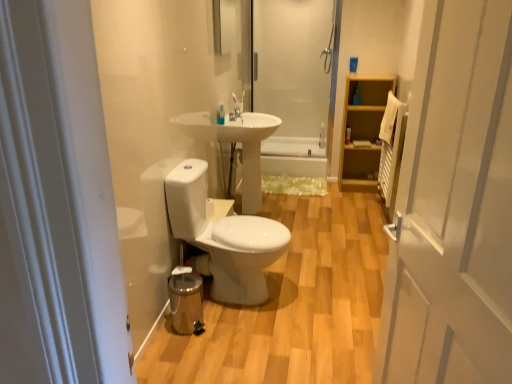
Question: In terms of height, does light wood cabinet at right look taller or shorter compared to white glossy door at right?

Choices:
 (A) short
 (B) tall

Answer: (A)

Question: Considering the positions of light wood cabinet at right and white glossy door at right in the image, is light wood cabinet at right wider or thinner than white glossy door at right?

Choices:
 (A) thin
 (B) wide

Answer: (B)

Question: Which is nearer to the white glossy sink at center?

Choices:
 (A) white glossy toilet at center
 (B) translucent plastic bottle at upper right, the 1th toiletry in the back-to-front sequence
 (C) white glossy bathtub at center
 (D) white glossy door at right
 (E) light wood cabinet at right

Answer: (A)

Question: Which of these objects is positioned farthest from the white glossy door at right?

Choices:
 (A) white glossy bathtub at center
 (B) white glossy toothbrush at upper center, the first toiletry positioned from the front
 (C) white glossy sink at center
 (D) glossy glass mirror at upper center
 (E) white glossy toilet at center

Answer: (A)